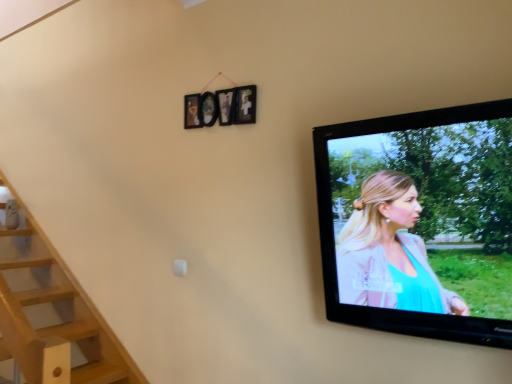
The height and width of the screenshot is (384, 512). I want to click on wooden picture frame at upper center, so click(229, 106).

The width and height of the screenshot is (512, 384). Describe the element at coordinates (229, 106) in the screenshot. I see `wooden picture frame at upper center` at that location.

Consider the image. In order to face black glossy television at upper right, should I rotate leftwards or rightwards?

Turn right by 19.633 degrees to look at black glossy television at upper right.

Locate an element on the screen. The image size is (512, 384). black glossy television at upper right is located at coordinates (414, 217).

Image resolution: width=512 pixels, height=384 pixels. Describe the element at coordinates (414, 217) in the screenshot. I see `black glossy television at upper right` at that location.

Find the location of a particular element. wooden picture frame at upper center is located at coordinates (229, 106).

Based on their positions, is wooden picture frame at upper center located to the left or right of black glossy television at upper right?

Based on their positions, wooden picture frame at upper center is located to the left of black glossy television at upper right.

Which is in front, wooden picture frame at upper center or black glossy television at upper right?

black glossy television at upper right.

Which is closer to the camera, (252, 110) or (397, 131)?

Point (252, 110).

From the image's perspective, is wooden picture frame at upper center located above or below black glossy television at upper right?

wooden picture frame at upper center is above black glossy television at upper right.

From a real-world perspective, is wooden picture frame at upper center above or below black glossy television at upper right?

Clearly, from a real-world perspective, wooden picture frame at upper center is above black glossy television at upper right.

Looking at their sizes, would you say wooden picture frame at upper center is wider or thinner than black glossy television at upper right?

wooden picture frame at upper center is thinner than black glossy television at upper right.

Who is shorter, wooden picture frame at upper center or black glossy television at upper right?

With less height is wooden picture frame at upper center.

Who is smaller, wooden picture frame at upper center or black glossy television at upper right?

wooden picture frame at upper center.

Is black glossy television at upper right completely or partially inside wooden picture frame at upper center?

Actually, black glossy television at upper right is outside wooden picture frame at upper center.

Is wooden picture frame at upper center not near black glossy television at upper right?

Actually, wooden picture frame at upper center and black glossy television at upper right are a little close together.

Is wooden picture frame at upper center aimed at black glossy television at upper right?

No, wooden picture frame at upper center is not oriented towards black glossy television at upper right.

This screenshot has width=512, height=384. Identify the location of television in front of the wooden picture frame at upper center. (414, 217).

Does black glossy television at upper right appear on the left side of wooden picture frame at upper center?

In fact, black glossy television at upper right is to the right of wooden picture frame at upper center.

Between black glossy television at upper right and wooden picture frame at upper center, which one is positioned in front?

black glossy television at upper right is more forward.

Is point (349, 284) in front of point (239, 90)?

Yes.

In the scene shown: From the image's perspective, between black glossy television at upper right and wooden picture frame at upper center, who is located below?

black glossy television at upper right appears lower in the image.

From a real-world perspective, is black glossy television at upper right physically below wooden picture frame at upper center?

Yes, from a real-world perspective, black glossy television at upper right is under wooden picture frame at upper center.

Between black glossy television at upper right and wooden picture frame at upper center, which one has smaller width?

With smaller width is wooden picture frame at upper center.

In the scene shown: From their relative heights in the image, would you say black glossy television at upper right is taller or shorter than wooden picture frame at upper center?

A: Clearly, black glossy television at upper right is taller compared to wooden picture frame at upper center.

Is black glossy television at upper right bigger than wooden picture frame at upper center?

Indeed, black glossy television at upper right has a larger size compared to wooden picture frame at upper center.

Is wooden picture frame at upper center located within black glossy television at upper right?

No, wooden picture frame at upper center is not surrounded by black glossy television at upper right.

Are black glossy television at upper right and wooden picture frame at upper center located far from each other?

No, black glossy television at upper right is not far from wooden picture frame at upper center.

From the picture: Is black glossy television at upper right aimed at wooden picture frame at upper center?

No, black glossy television at upper right is not aimed at wooden picture frame at upper center.

What's the angular difference between black glossy television at upper right and wooden picture frame at upper center's facing directions?

1.12 degrees separate the facing orientations of black glossy television at upper right and wooden picture frame at upper center.

Find the location of a particular element. The image size is (512, 384). picture frame above the black glossy television at upper right (from the image's perspective) is located at coordinates 229,106.

Locate an element on the screen. picture frame on the left side of black glossy television at upper right is located at coordinates (229, 106).

At what (x,y) coordinates should I click in order to perform the action: click on picture frame above the black glossy television at upper right (from the image's perspective). Please return your answer as a coordinate pair (x, y). Looking at the image, I should click on (229, 106).